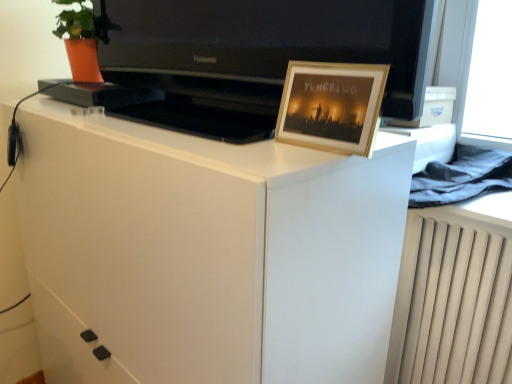
Question: Is point (257, 49) closer or farther from the camera than point (285, 253)?

Choices:
 (A) closer
 (B) farther

Answer: (B)

Question: Is black glossy television at upper center wider or thinner than white glossy cabinet at center?

Choices:
 (A) wide
 (B) thin

Answer: (B)

Question: Estimate the real-world distances between objects in this image. Which object is closer to the black glossy television at upper center?

Choices:
 (A) white glossy cabinet at center
 (B) wooden picture frame at upper right

Answer: (B)

Question: Estimate the real-world distances between objects in this image. Which object is farther from the white glossy cabinet at center?

Choices:
 (A) wooden picture frame at upper right
 (B) black glossy television at upper center

Answer: (B)